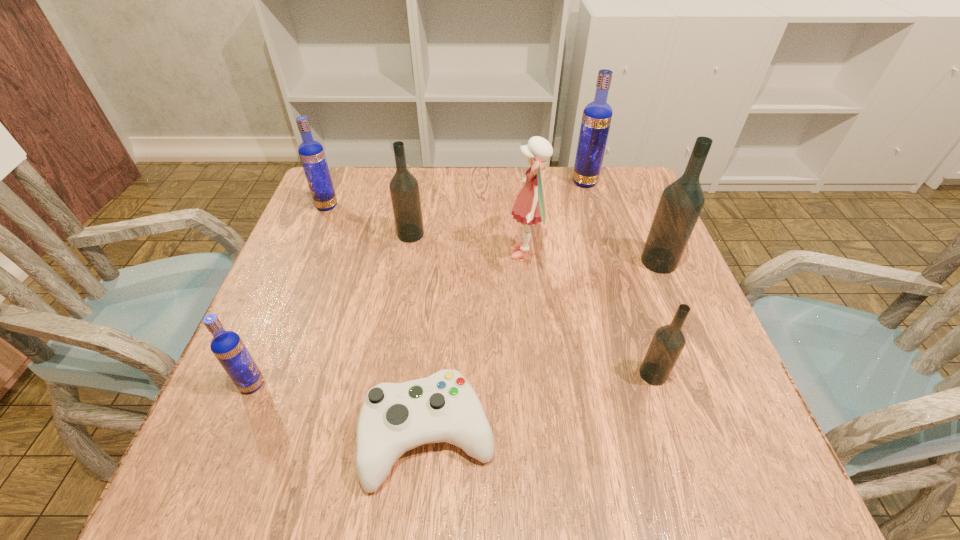
At what (x,y) coordinates should I click in order to perform the action: click on the nearest blue vodka. Please return your answer as a coordinate pair (x, y). The image size is (960, 540). Looking at the image, I should click on (227, 346).

The height and width of the screenshot is (540, 960). I want to click on the smallest black vodka, so click(x=669, y=340).

Locate an element on the screen. the second black vodka from right to left is located at coordinates (669, 340).

You are a GUI agent. You are given a task and a screenshot of the screen. Output one action in this format:
    pyautogui.click(x=<x>, y=<y>)
    Task: Click on the shortest object
    Image resolution: width=960 pixels, height=540 pixels.
    Given the screenshot: What is the action you would take?
    pyautogui.click(x=394, y=418)

This screenshot has width=960, height=540. In order to click on control in this screenshot , I will do `click(394, 418)`.

Find the location of a particular element. Image resolution: width=960 pixels, height=540 pixels. vacant area situated 0.080m on the left of the farthest object is located at coordinates (543, 182).

The image size is (960, 540). I want to click on free location located 0.150m on the front of the rightmost object, so click(686, 328).

The image size is (960, 540). Find the location of `free point located 0.170m on the front-facing side of the doll`. free point located 0.170m on the front-facing side of the doll is located at coordinates (433, 253).

Locate an element on the screen. Image resolution: width=960 pixels, height=540 pixels. free region located 0.290m on the front-facing side of the doll is located at coordinates (381, 253).

Image resolution: width=960 pixels, height=540 pixels. I want to click on vacant space located 0.110m on the front-facing side of the doll, so click(x=459, y=253).